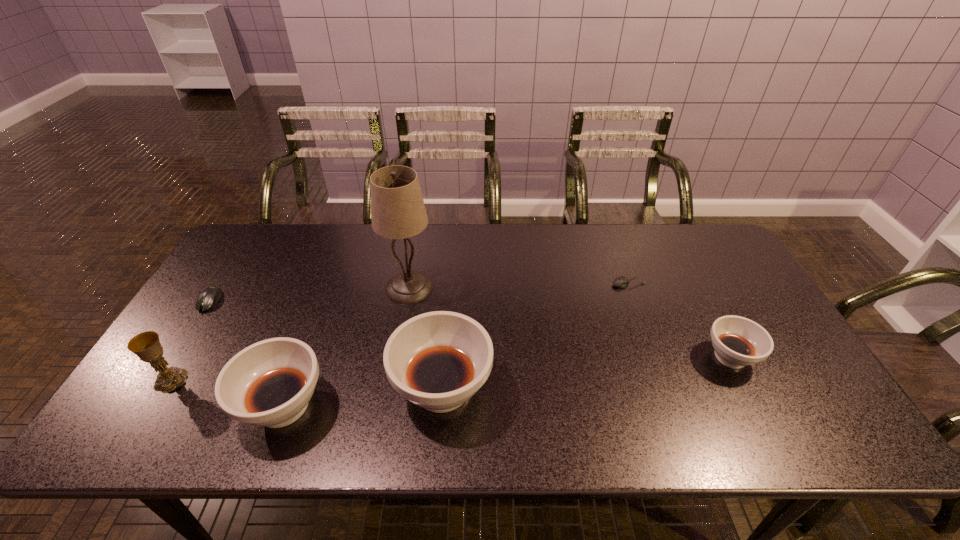
This screenshot has width=960, height=540. Identify the location of vacant space at the near right corner of the desktop. (816, 396).

At what (x,y) coordinates should I click in order to perform the action: click on empty location between the tallest object and the shortest soup bowl. Please return your answer as a coordinate pair (x, y). This screenshot has height=540, width=960. Looking at the image, I should click on (570, 322).

This screenshot has height=540, width=960. In order to click on free area in between the shorter mouse and the tallest object in this screenshot , I will do `click(519, 286)`.

The width and height of the screenshot is (960, 540). I want to click on free space that is in between the shortest object and the tallest object, so click(519, 286).

Locate an element on the screen. This screenshot has width=960, height=540. free space between the second soup bowl from left to right and the second shortest soup bowl is located at coordinates (363, 397).

Where is `free space between the second soup bowl from right to left and the rightmost soup bowl`? Image resolution: width=960 pixels, height=540 pixels. free space between the second soup bowl from right to left and the rightmost soup bowl is located at coordinates (587, 373).

Image resolution: width=960 pixels, height=540 pixels. I want to click on vacant area that lies between the left mouse and the chalice, so click(x=190, y=340).

The height and width of the screenshot is (540, 960). I want to click on unoccupied position between the taller mouse and the chalice, so click(190, 340).

Identify the location of object that is the third closest to the rightmost soup bowl. The width and height of the screenshot is (960, 540). (397, 208).

Identify the location of object that can be found as the fourth closest to the chalice. (438, 360).